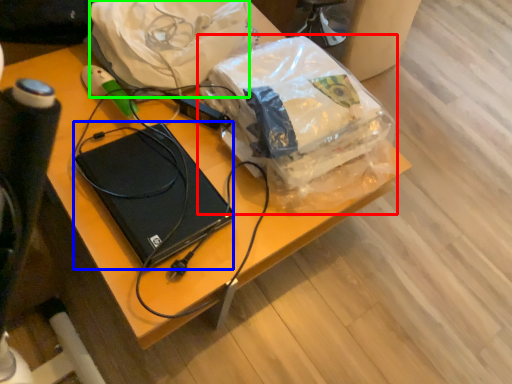
Question: Which is nearer to the plastic bag (highlighted by a red box)? computer (highlighted by a blue box) or material (highlighted by a green box).

Choices:
 (A) computer
 (B) material

Answer: (B)